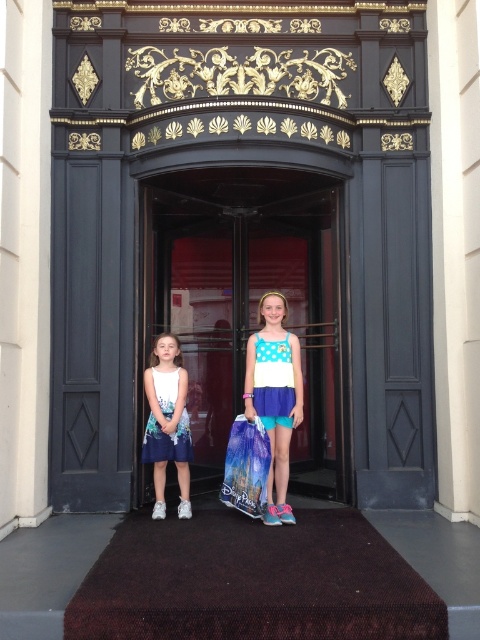
How much distance is there between black glossy elevator at center and polka dot dress at center?

They are 1.26 meters apart.

Which is behind, point (411, 61) or point (269, 326)?

The point (411, 61) is behind.

You are a GUI agent. You are given a task and a screenshot of the screen. Output one action in this format:
    pyautogui.click(x=<x>, y=<y>)
    Task: Click on the black glossy elevator at center
    Image resolution: width=480 pixels, height=640 pixels.
    Given the screenshot: What is the action you would take?
    pyautogui.click(x=240, y=218)

Does black glossy elevator at center have a lesser width compared to brown textured doormat at center?

No.

This screenshot has height=640, width=480. Describe the element at coordinates (240, 218) in the screenshot. I see `black glossy elevator at center` at that location.

Describe the element at coordinates (240, 218) in the screenshot. I see `black glossy elevator at center` at that location.

Locate an element on the screen. This screenshot has height=640, width=480. black glossy elevator at center is located at coordinates (240, 218).

Who is shorter, brown textured doormat at center or polka dot dress at center?

Standing shorter between the two is brown textured doormat at center.

Is point (349, 515) closer to camera compared to point (261, 392)?

No, (349, 515) is behind (261, 392).

This screenshot has width=480, height=640. Identify the location of brown textured doormat at center. (252, 580).